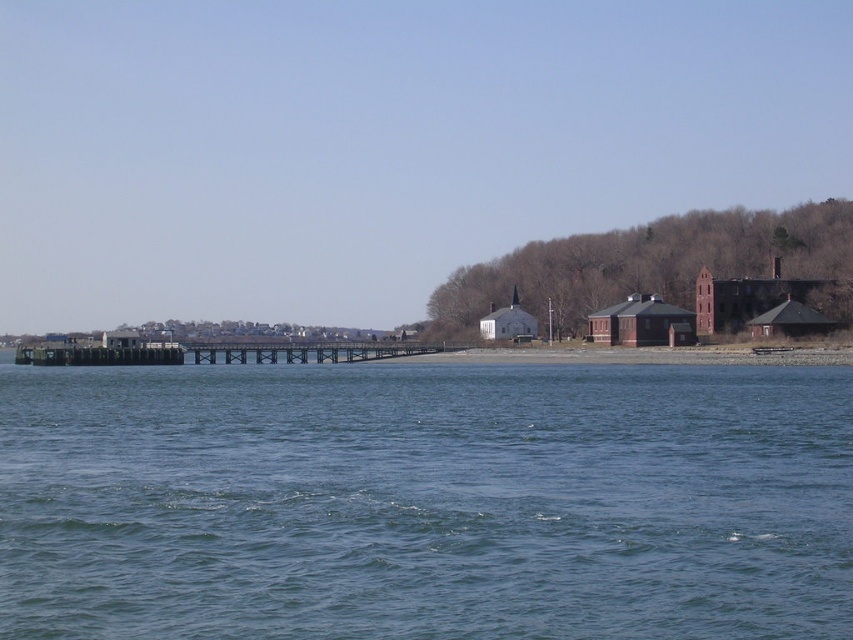
You are a boat operator planning to dock your vessel. The boat requires a minimum width of 10 meters to safely maneuver. Given the scene described, can the blue water at center accommodate your boat if the brown wooden dock at center is already occupying part of the space?

The blue water at center has a larger width than the brown wooden dock at center. Since the water is wider, it can accommodate the boat requiring 10 meters as long as the dock does not block the necessary space.

You are standing on the brown wooden dock at center and want to reach the blue water at center. Which direction should you move to get there?

The blue water at center is positioned on the right side of the brown wooden dock at center, so you should move to the right to reach it.

You are standing on the shore and looking out at the scene. Which object, the blue water at center or the brown wooden dock at center, is closer to you?

The blue water at center is closer to you because it is in front of the brown wooden dock at center.